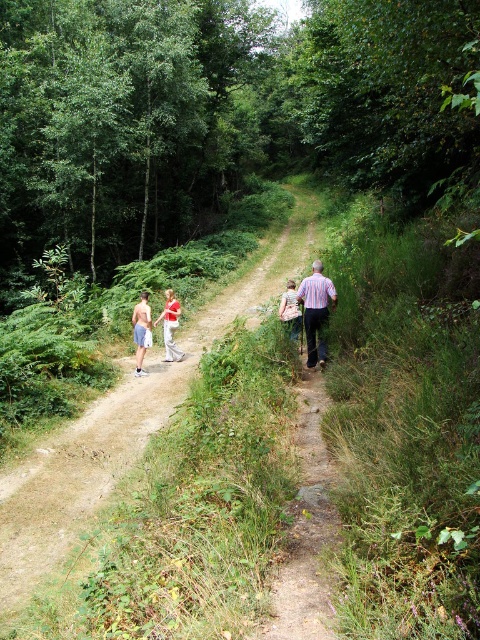
Question: Which point appears closest to the camera in this image?

Choices:
 (A) (146, 392)
 (B) (288, 317)
 (C) (307, 362)

Answer: (C)

Question: Which point is closer to the camera?

Choices:
 (A) (140, 324)
 (B) (38, 556)

Answer: (B)

Question: Where is dirt path at center located in relation to striped shirt at center in the image?

Choices:
 (A) above
 (B) below

Answer: (B)

Question: Is blue shorts at left above light brown fabric shirt at center?

Choices:
 (A) no
 (B) yes

Answer: (A)

Question: Which point is closer to the camera?

Choices:
 (A) (288, 324)
 (B) (144, 372)
 (C) (162, 317)
 (D) (66, 445)

Answer: (D)

Question: Does blue shorts at left have a greater width compared to light blue denim shorts at left?

Choices:
 (A) no
 (B) yes

Answer: (B)